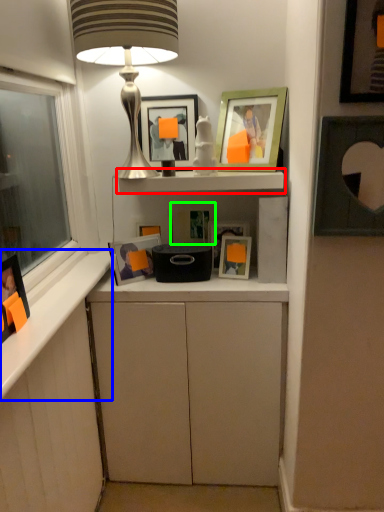
Question: Based on their relative distances, which object is farther from shelf (highlighted by a red box)? Choose from counter top (highlighted by a blue box) and picture frame (highlighted by a green box).

Choices:
 (A) counter top
 (B) picture frame

Answer: (A)